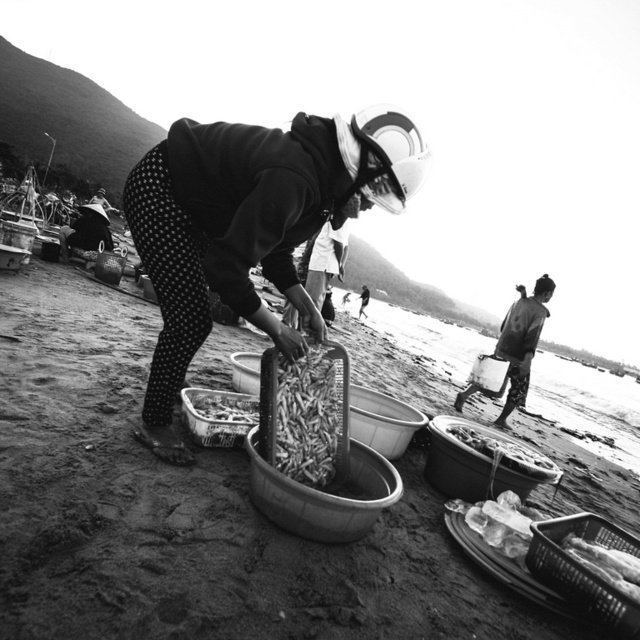
Does smooth plastic basket at lower right come behind translucent plastic basket at lower right?

That is True.

Is point (465, 442) closer to viewer compared to point (582, 560)?

No, it is behind (582, 560).

Locate an element on the screen. This screenshot has width=640, height=640. smooth plastic basket at lower right is located at coordinates coord(506,451).

Is point (310, 372) closer to camera compared to point (524, 460)?

That is True.

Is point (291, 403) positioned after point (480, 429)?

No, (291, 403) is closer to viewer.

Measure the distance between point (x=288, y=369) and camera.

They are 7.75 feet apart.

Locate an element on the screen. This screenshot has width=640, height=640. grainy wooden crate at center is located at coordinates (305, 413).

The image size is (640, 640). Describe the element at coordinates (218, 416) in the screenshot. I see `metallic wire mesh basket at lower center` at that location.

From the picture: Which is more to the left, metallic wire mesh basket at lower center or shiny metallic tray at center?

From the viewer's perspective, metallic wire mesh basket at lower center appears more on the left side.

What do you see at coordinates (218, 416) in the screenshot?
I see `metallic wire mesh basket at lower center` at bounding box center [218, 416].

Locate an element on the screen. Image resolution: width=640 pixels, height=640 pixels. metallic wire mesh basket at lower center is located at coordinates (218, 416).